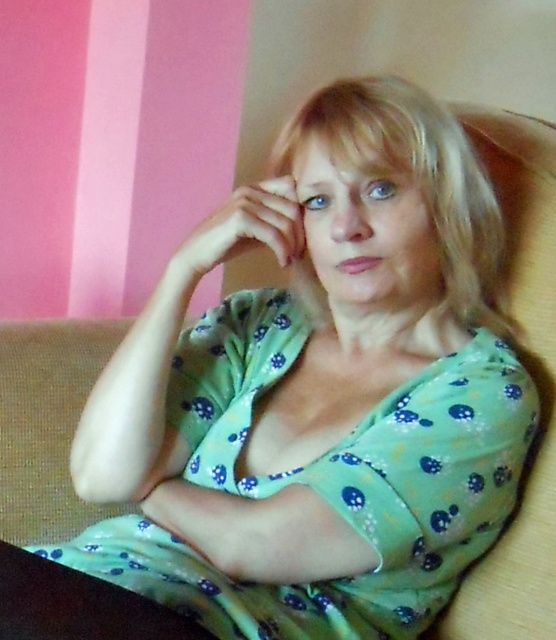
Does blonde smooth hair at center have a larger size compared to matte green hand at center?

Yes, blonde smooth hair at center is bigger than matte green hand at center.

At what (x,y) coordinates should I click in order to perform the action: click on blonde smooth hair at center. Please return your answer as a coordinate pair (x, y). This screenshot has width=556, height=640. Looking at the image, I should click on (414, 179).

The height and width of the screenshot is (640, 556). What do you see at coordinates (330, 481) in the screenshot? I see `green dotted fabric dress at center` at bounding box center [330, 481].

Is green dotted fabric dress at center to the left of blonde smooth hair at center from the viewer's perspective?

Indeed, green dotted fabric dress at center is positioned on the left side of blonde smooth hair at center.

You are a GUI agent. You are given a task and a screenshot of the screen. Output one action in this format:
    pyautogui.click(x=<x>, y=<y>)
    Task: Click on the green dotted fabric dress at center
    This screenshot has width=556, height=640.
    Given the screenshot: What is the action you would take?
    pyautogui.click(x=330, y=481)

Between green dotted fabric dress at center and matte green hand at center, which one appears on the left side from the viewer's perspective?

matte green hand at center is more to the left.

Does point (508, 392) come in front of point (291, 227)?

Yes, point (508, 392) is in front of point (291, 227).

Locate an element on the screen. The height and width of the screenshot is (640, 556). green dotted fabric dress at center is located at coordinates (330, 481).